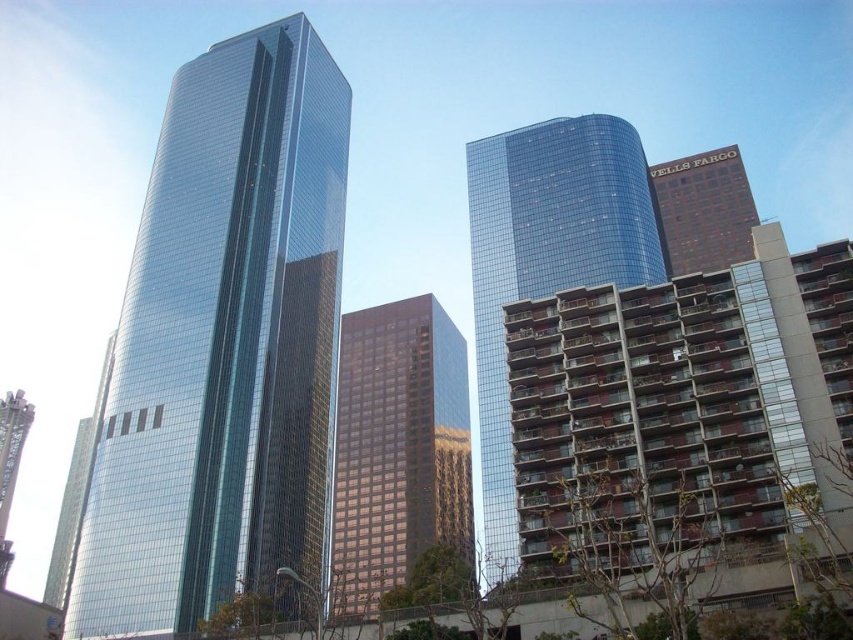
You are an architect analyzing the urban skyline. You notice the glossy glass skyscraper at center and the brick textured building at upper right. Which of these two buildings has a narrower width?

The glossy glass skyscraper at center is thinner than the brick textured building at upper right, so it has a narrower width.

You are an architect analyzing the urban skyline. You observe the glossy glass building at center and the brick textured building at upper right. Which of these two buildings appears larger in the scene?

The glossy glass building at center appears larger than the brick textured building at upper right.